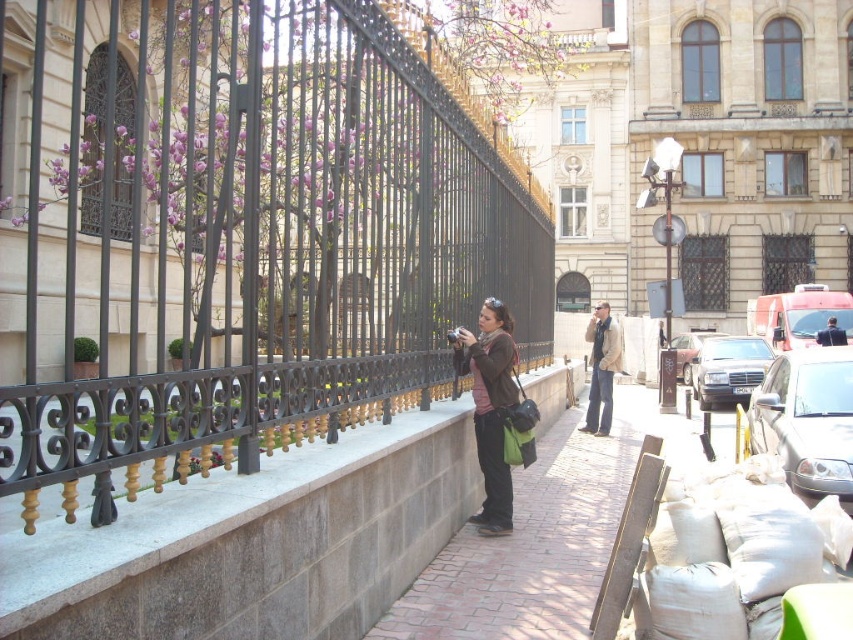
From the picture: You are standing at the center of the walkway and want to park your car in the parking spot that is closest to the decorative black wrought iron fence. Which car, the metallic silver car at right, is in the way of your parking spot?

The metallic silver car at right is located at point (807, 420), so it is blocking the parking spot closest to the decorative black wrought iron fence.

From the picture: You are a delivery person who needs to place a package between the light beige leather jacket at center and the dark blue suit at center. Can you fit the package between them?

The light beige leather jacket at center is located above the dark blue suit at center, so there is vertical space between them. However, since the jacket is above the suit, there may not be enough horizontal space to place a package between them unless the package is very small and can fit in the gap between the two items.